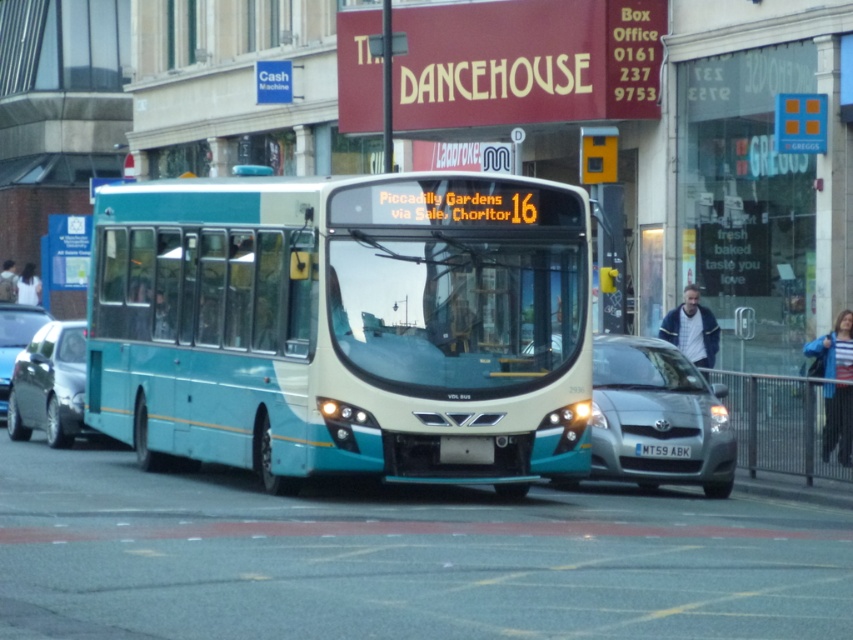
Is metallic silver car at center closer to the viewer compared to white plastic license plate at center?

No, metallic silver car at center is further to the viewer.

Is point (3, 332) positioned after point (659, 449)?

Yes, it is behind point (659, 449).

Image resolution: width=853 pixels, height=640 pixels. In order to click on metallic silver car at center in this screenshot , I will do `click(15, 340)`.

What are the coordinates of `metallic silver car at center` in the screenshot? It's located at (15, 340).

Is metallic silver car at left closer to the viewer compared to metallic silver car at center?

Yes, metallic silver car at left is in front of metallic silver car at center.

Does metallic silver car at left have a greater width compared to metallic silver car at center?

Yes.

Is point (62, 428) farther from camera compared to point (10, 355)?

No, (62, 428) is closer to viewer.

Locate an element on the screen. This screenshot has height=640, width=853. metallic silver car at left is located at coordinates (49, 385).

Between silver metallic hatchback at center and metallic silver car at left, which one has more height?

silver metallic hatchback at center

Where is `silver metallic hatchback at center`? silver metallic hatchback at center is located at coordinates (657, 417).

What do you see at coordinates (657, 417) in the screenshot?
I see `silver metallic hatchback at center` at bounding box center [657, 417].

At what (x,y) coordinates should I click in order to perform the action: click on silver metallic hatchback at center. Please return your answer as a coordinate pair (x, y). Looking at the image, I should click on click(x=657, y=417).